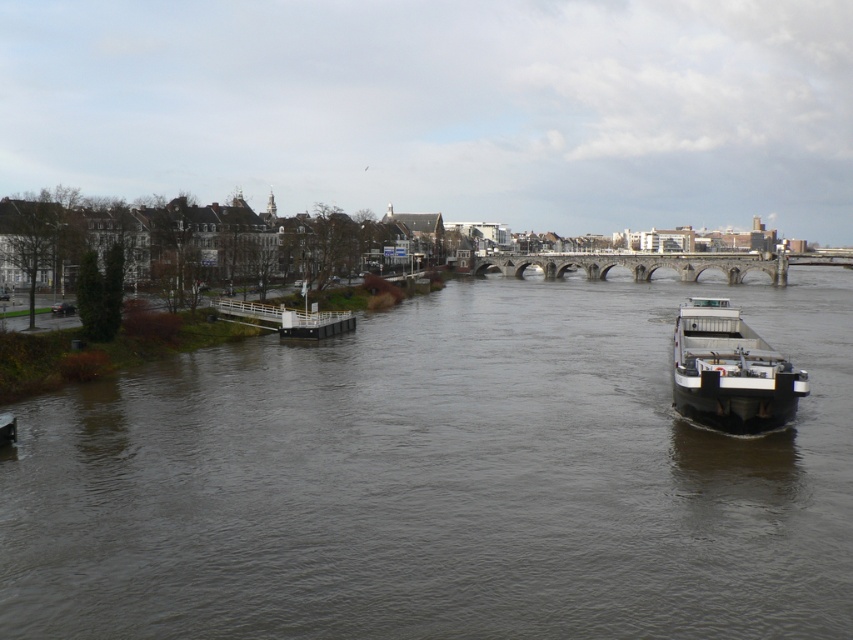
Based on the provided scene description, what are the coordinates of the white matte barge at right in the image?

The white matte barge at right is located at coordinates (730, 371) in the image.